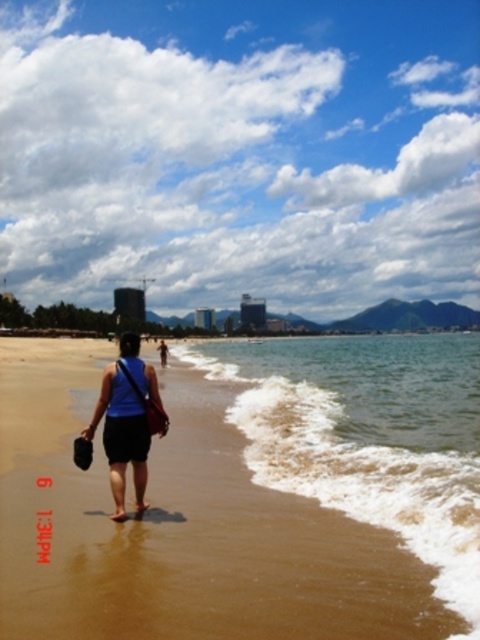
Question: Can you confirm if brown sandy water at lower right is thinner than blue fabric bag at center?

Choices:
 (A) no
 (B) yes

Answer: (A)

Question: Is brown sandy water at lower right wider than blue fabric bag at center?

Choices:
 (A) no
 (B) yes

Answer: (B)

Question: Which point is farther from the camera taking this photo?

Choices:
 (A) (336, 420)
 (B) (110, 384)

Answer: (A)

Question: Which of the following is the closest to the observer?

Choices:
 (A) (100, 404)
 (B) (396, 532)

Answer: (B)

Question: In this image, where is brown sandy water at lower right located relative to blue fabric bag at center?

Choices:
 (A) left
 (B) right

Answer: (B)

Question: Which point appears closest to the camera in this image?

Choices:
 (A) (103, 385)
 (B) (256, 476)

Answer: (A)